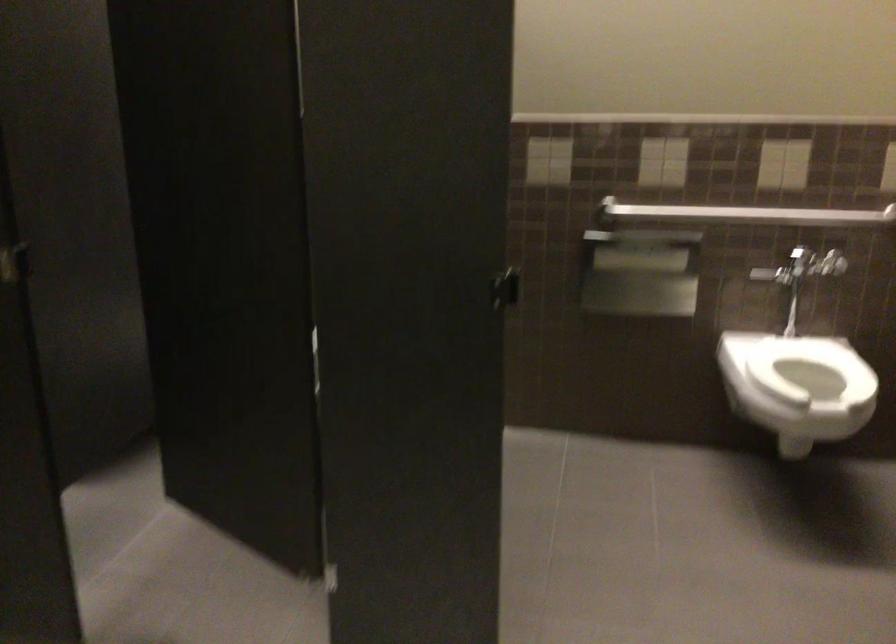
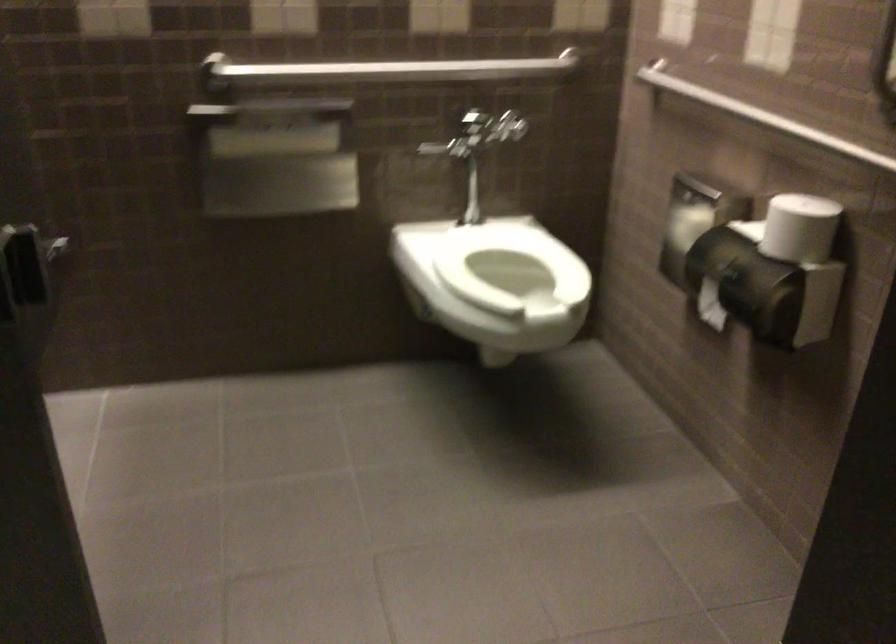
Where in the second image is the point corresponding to point 741,212 from the first image?

(391, 69)